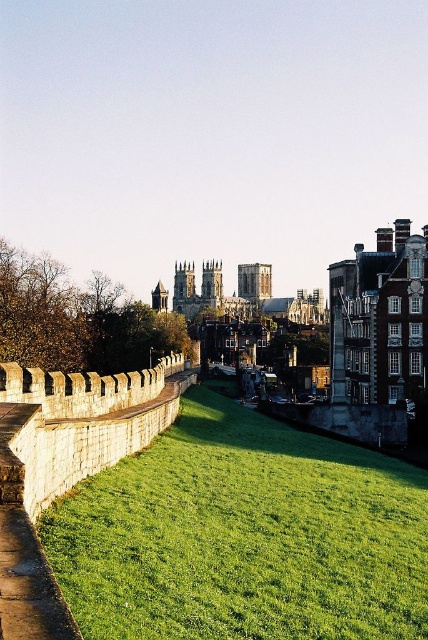
You are a GUI agent. You are given a task and a screenshot of the screen. Output one action in this format:
    pyautogui.click(x=<x>, y=<y>)
    Task: Click on the green grassy at center
    
    Given the screenshot: What is the action you would take?
    pyautogui.click(x=243, y=536)

This screenshot has width=428, height=640. Describe the element at coordinates (243, 536) in the screenshot. I see `green grassy at center` at that location.

Is point (389, 531) positioned after point (214, 269)?

No, (389, 531) is closer to viewer.

The width and height of the screenshot is (428, 640). Identify the location of green grassy at center. (243, 536).

Is green grassy at center wider than dark brown stone tower at center?

Correct, the width of green grassy at center exceeds that of dark brown stone tower at center.

Who is more distant from viewer, (196,624) or (246,289)?

The point (246,289) is more distant.

The height and width of the screenshot is (640, 428). In order to click on green grassy at center in this screenshot , I will do `click(243, 536)`.

How distant is dark brown stone tower at center from smooth stone tower at center?

dark brown stone tower at center is 135.91 feet away from smooth stone tower at center.

The height and width of the screenshot is (640, 428). I want to click on dark brown stone tower at center, so click(255, 282).